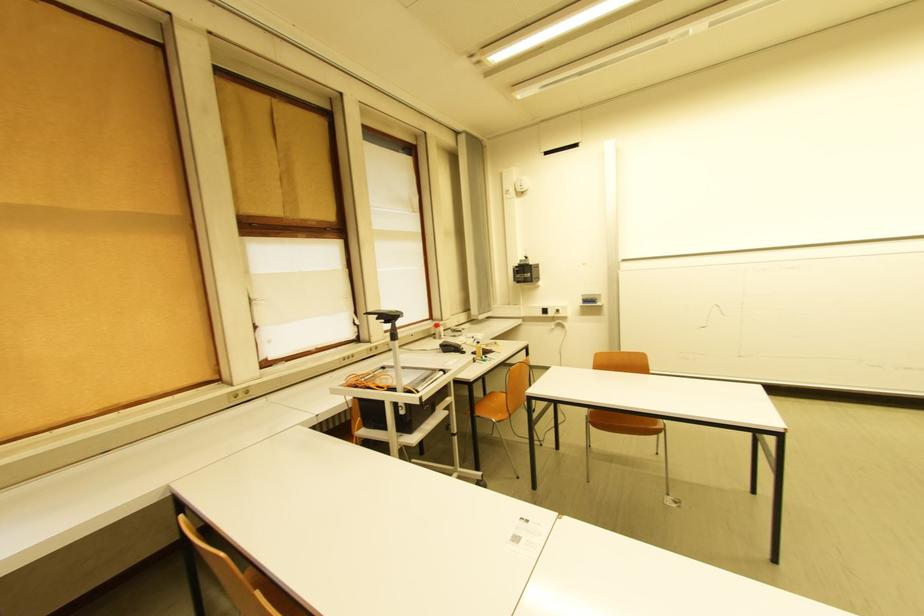
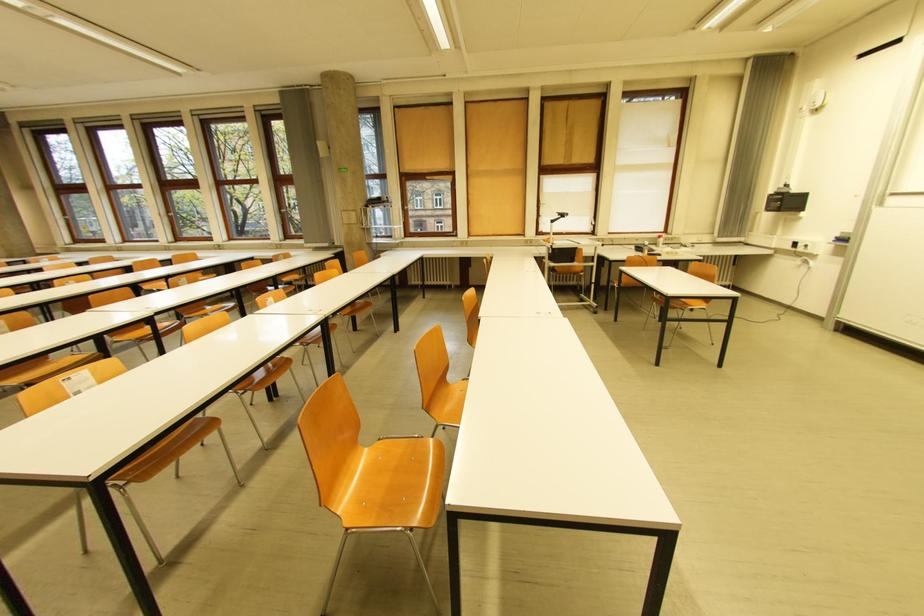
The point at (435, 331) is marked in the first image. Where is the corresponding point in the second image?

(662, 240)